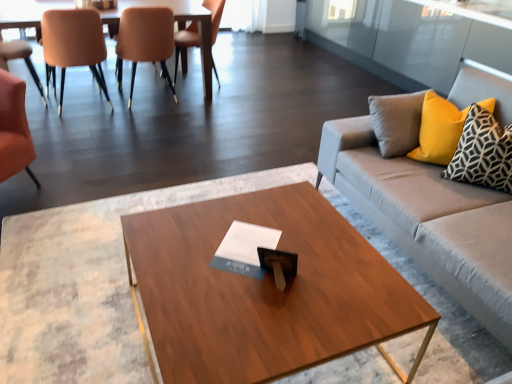
Question: Is matte orange chair at left, the first chair positioned from the left, turned away from orange leather chair at left, placed as the second chair when sorted from left to right?

Choices:
 (A) yes
 (B) no

Answer: (B)

Question: Would you consider matte orange chair at left, the 5th chair positioned from the right, to be distant from orange leather chair at left, placed as the second chair when sorted from left to right?

Choices:
 (A) yes
 (B) no

Answer: (B)

Question: Can you confirm if matte orange chair at left, the 5th chair positioned from the right, is bigger than orange leather chair at left, the fourth chair viewed from the right?

Choices:
 (A) yes
 (B) no

Answer: (B)

Question: Can you confirm if matte orange chair at left, the first chair positioned from the left, is smaller than orange leather chair at left, placed as the second chair when sorted from left to right?

Choices:
 (A) yes
 (B) no

Answer: (A)

Question: Can you confirm if matte orange chair at left, the 5th chair positioned from the right, is positioned to the right of orange leather chair at left, the fourth chair viewed from the right?

Choices:
 (A) no
 (B) yes

Answer: (A)

Question: Considering the relative sizes of matte orange chair at left, the 5th chair positioned from the right, and orange leather chair at left, the fourth chair viewed from the right, in the image provided, is matte orange chair at left, the 5th chair positioned from the right, wider than orange leather chair at left, the fourth chair viewed from the right,?

Choices:
 (A) no
 (B) yes

Answer: (A)

Question: From a real-world perspective, does matte orange chair at left, arranged as the 3th chair when viewed from the left, stand above wooden coffee table at center?

Choices:
 (A) yes
 (B) no

Answer: (A)

Question: Is matte orange chair at left, arranged as the 3th chair when viewed from the left, looking in the opposite direction of wooden coffee table at center?

Choices:
 (A) yes
 (B) no

Answer: (A)

Question: Is matte orange chair at left, arranged as the 3th chair when viewed from the left, directly adjacent to wooden coffee table at center?

Choices:
 (A) no
 (B) yes

Answer: (A)

Question: Considering the relative sizes of matte orange chair at left, which is the third chair from right to left, and wooden coffee table at center in the image provided, is matte orange chair at left, which is the third chair from right to left, taller than wooden coffee table at center?

Choices:
 (A) no
 (B) yes

Answer: (B)

Question: Does matte orange chair at left, which is the third chair from right to left, have a lesser width compared to wooden coffee table at center?

Choices:
 (A) yes
 (B) no

Answer: (A)

Question: Considering the relative positions of matte orange chair at left, which is the third chair from right to left, and wooden coffee table at center in the image provided, is matte orange chair at left, which is the third chair from right to left, behind wooden coffee table at center?

Choices:
 (A) yes
 (B) no

Answer: (A)

Question: Is wooden coffee table at center positioned before orange leather chair at left, the fourth chair viewed from the right?

Choices:
 (A) yes
 (B) no

Answer: (A)